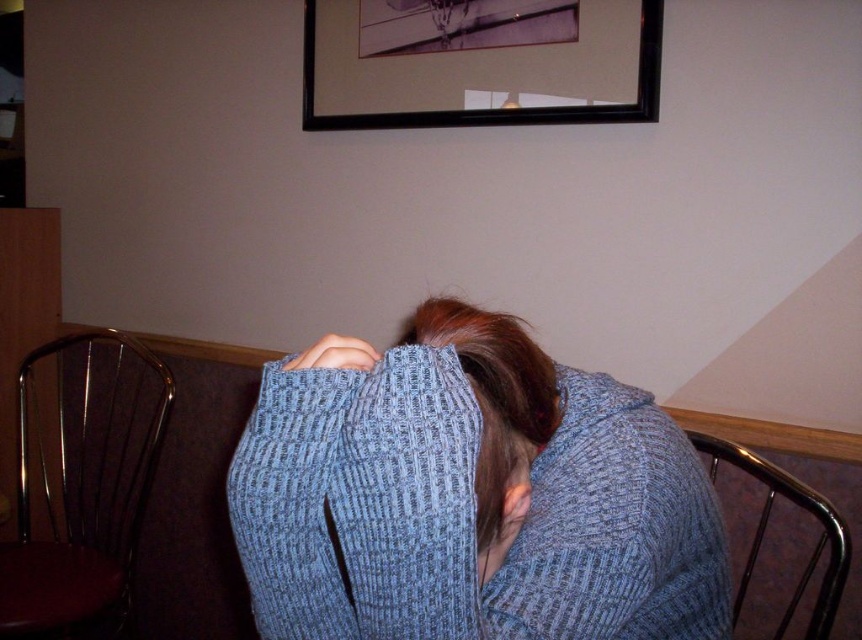
You are a painter standing 5 feet away from the black matte picture frame at upper center. You want to step back to create some space between you and the frame. If you move back by 1 foot, will you be more than 5 feet away from the frame?

The initial distance between you and the black matte picture frame at upper center is 5 feet. When you move back by 1 foot, your new distance becomes 6 feet. Since 6 feet is greater than 5 feet, you will indeed be more than 5 feet away from the frame after moving back.

You are standing in a room and want to take a closer look at the black matte picture frame at upper center. If you move forward 1 meter, will you be able to touch it?

The black matte picture frame at upper center is 1.35 meters away from the camera. If you move forward 1 meter, you will still be 0.35 meters away from it and won not be able to touch it.

You are an interior designer planning to hang a new artwork in this room. The new artwork is the same size as the metallic brown chair at left. Will the new artwork fit within the space currently occupied by the black matte picture frame at upper center?

The black matte picture frame at upper center is wider than the metallic brown chair at left. Since the new artwork is the same size as the metallic brown chair at left, it will fit within the space currently occupied by the black matte picture frame at upper center because the existing frame is larger in width.